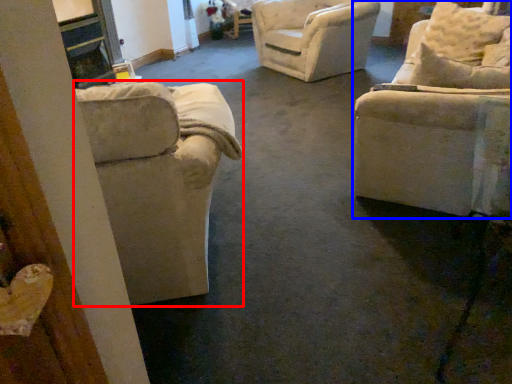
Question: Which object appears farthest to the camera in this image, chair (highlighted by a red box) or chair (highlighted by a blue box)?

Choices:
 (A) chair
 (B) chair

Answer: (B)